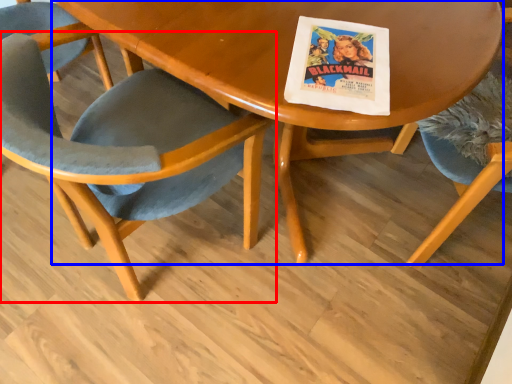
Question: Which object is closer to the camera taking this photo, chair (highlighted by a red box) or table (highlighted by a blue box)?

Choices:
 (A) chair
 (B) table

Answer: (A)